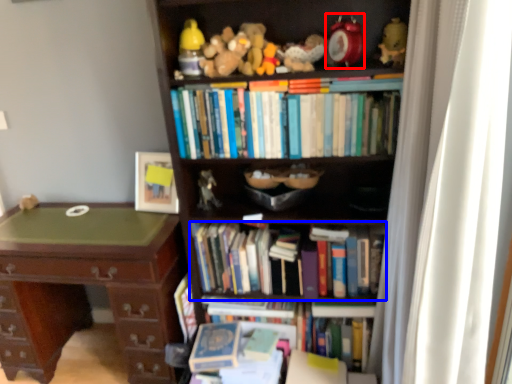
Question: Among these objects, which one is farthest to the camera, toy (highlighted by a red box) or book (highlighted by a blue box)?

Choices:
 (A) toy
 (B) book

Answer: (B)